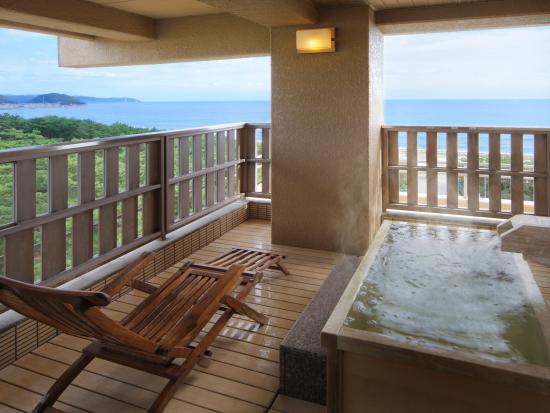
Locate an element on the screen. This screenshot has height=413, width=550. bath tub is located at coordinates coord(467,300).